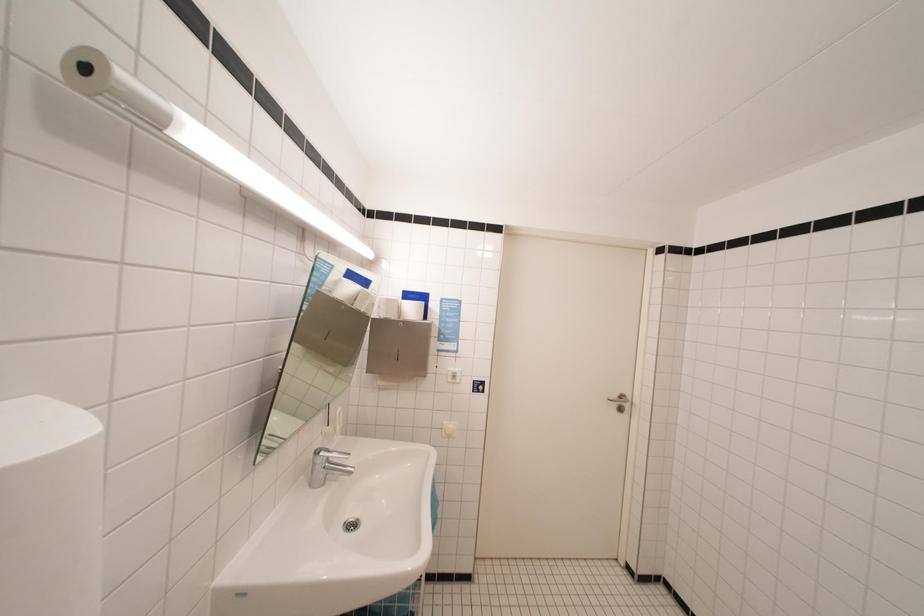
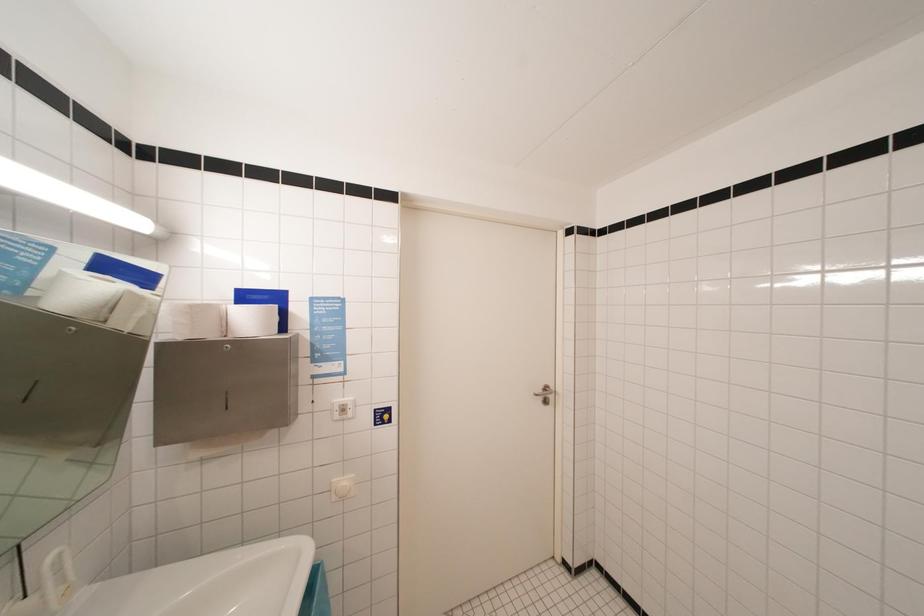
Question: Which direction would the cameraman need to move to produce the second image? Reply with the corresponding letter.

Choices:
 (A) Left
 (B) Right
 (C) Forward
 (D) Backward

Answer: (C)